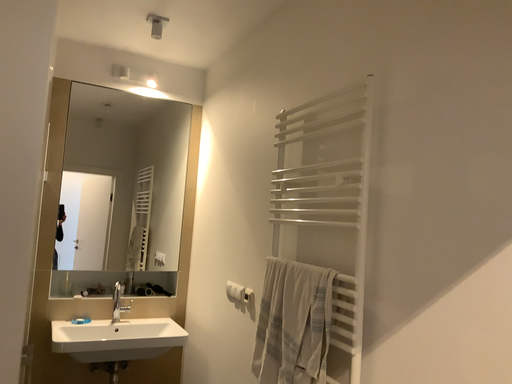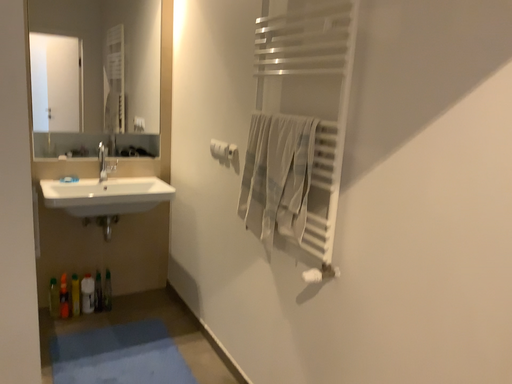
Question: How did the camera likely rotate when shooting the video?

Choices:
 (A) rotated downward
 (B) rotated upward

Answer: (A)